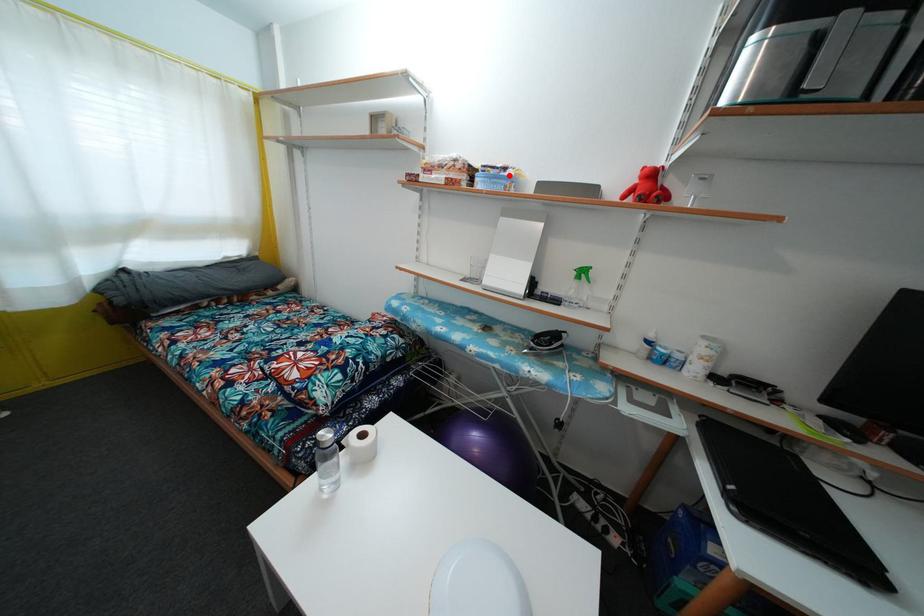
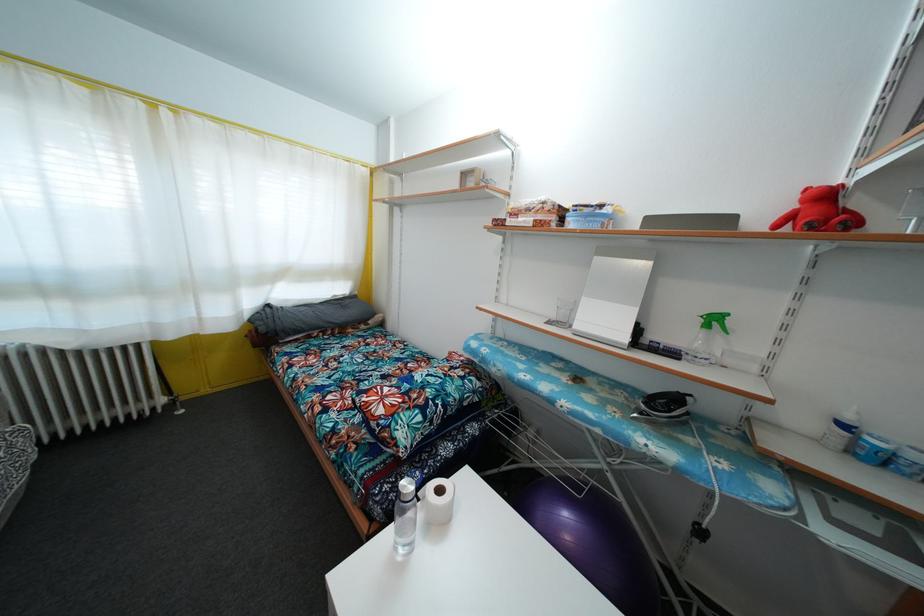
In the second image, find the point that corresponds to the highlighted location in the first image.

(605, 213)